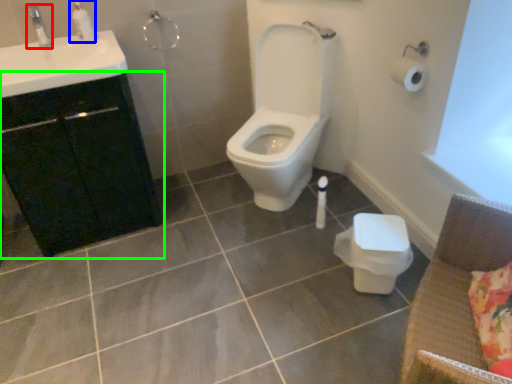
Question: Based on their relative distances, which object is farther from plumbing fixture (highlighted by a red box)? Choose from soap dispenser (highlighted by a blue box) and bathroom cabinet (highlighted by a green box).

Choices:
 (A) soap dispenser
 (B) bathroom cabinet

Answer: (B)